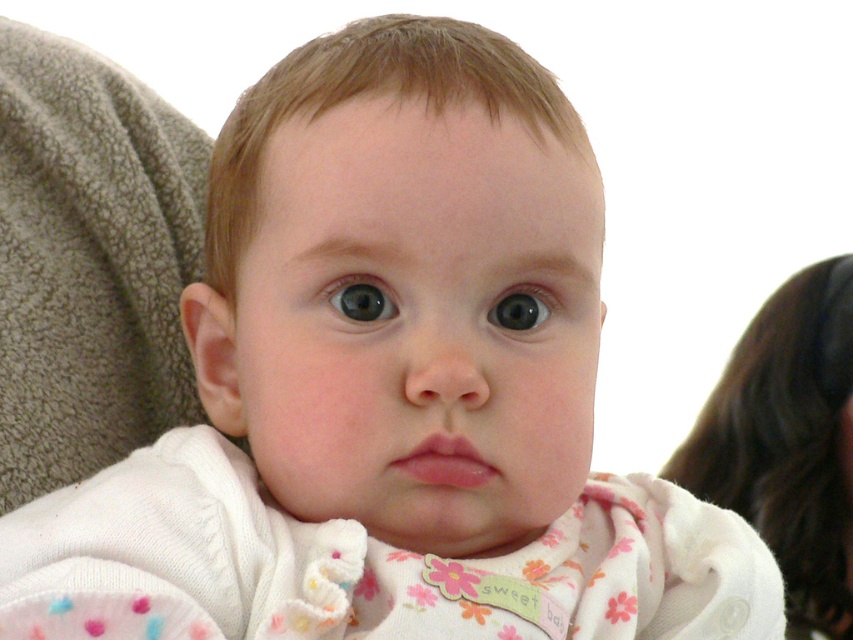
Question: Which object is positioned farthest from the white soft fabric at upper right?

Choices:
 (A) blue glossy eye at center
 (B) shiny black eye at center

Answer: (A)

Question: In this image, where is blue glossy eye at center located relative to shiny black eye at center?

Choices:
 (A) right
 (B) left

Answer: (B)

Question: Does white soft fabric at upper right have a smaller size compared to shiny black eye at center?

Choices:
 (A) yes
 (B) no

Answer: (B)

Question: Estimate the real-world distances between objects in this image. Which object is closer to the white soft fabric at upper right?

Choices:
 (A) shiny black eye at center
 (B) blue glossy eye at center

Answer: (A)

Question: Which object is farther from the camera taking this photo?

Choices:
 (A) shiny black eye at center
 (B) blue glossy eye at center

Answer: (A)

Question: Where is white soft fabric at upper right located in relation to blue glossy eye at center in the image?

Choices:
 (A) above
 (B) below

Answer: (B)